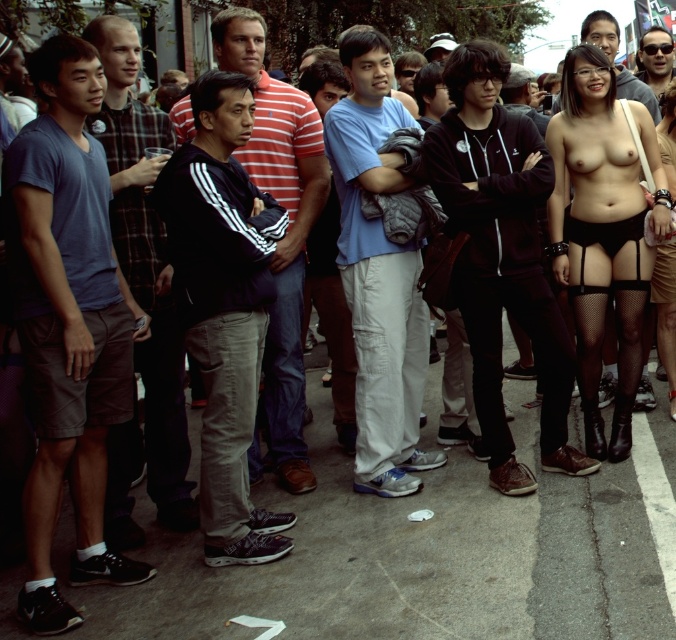
I want to click on black leather stockings at center, so click(x=665, y=314).

Between black leather stockings at center and matte black jacket at center, which one is positioned higher?

matte black jacket at center is higher up.

This screenshot has height=640, width=676. What do you see at coordinates (665, 314) in the screenshot? I see `black leather stockings at center` at bounding box center [665, 314].

Where is `black leather stockings at center`? This screenshot has height=640, width=676. black leather stockings at center is located at coordinates (665, 314).

Between light blue cotton shirt at center and black adidas jacket at center, which one is positioned higher?

black adidas jacket at center is higher up.

Which is more to the right, light blue cotton shirt at center or black adidas jacket at center?

light blue cotton shirt at center

Which is in front, point (341, 212) or point (268, 326)?

Positioned in front is point (341, 212).

The width and height of the screenshot is (676, 640). Find the location of `light blue cotton shirt at center`. light blue cotton shirt at center is located at coordinates (379, 275).

Locate an element on the screen. This screenshot has width=676, height=640. black matte hoodie at center is located at coordinates (502, 256).

Does black matte hoodie at center have a lesser height compared to black matte bikini top at right?

No.

At what (x,y) coordinates should I click in order to perform the action: click on black matte hoodie at center. Please return your answer as a coordinate pair (x, y). Looking at the image, I should click on (502, 256).

You are a GUI agent. You are given a task and a screenshot of the screen. Output one action in this format:
    pyautogui.click(x=<x>, y=<y>)
    Task: Click on the black matte hoodie at center
    This screenshot has width=676, height=640.
    Given the screenshot: What is the action you would take?
    pyautogui.click(x=502, y=256)